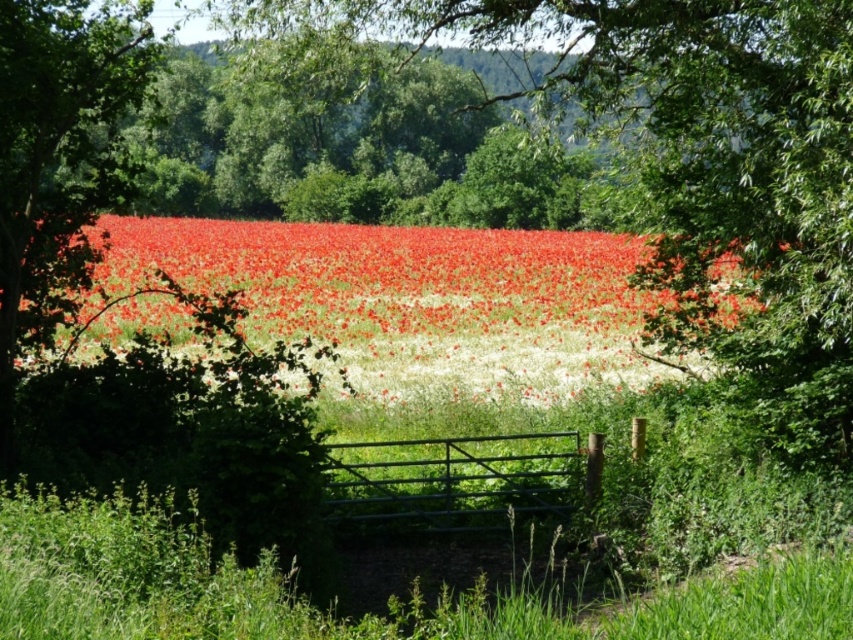
Can you confirm if bright red petals at center is bigger than metallic gate at center?

Yes.

Looking at this image, can you confirm if bright red petals at center is wider than metallic gate at center?

Yes.

Between point (473, 328) and point (352, 490), which one is positioned behind?

The point (473, 328) is more distant.

Find the location of a particular element. The image size is (853, 640). bright red petals at center is located at coordinates (413, 300).

Does green leafy tree at center have a lesser width compared to bright red petals at center?

Correct, green leafy tree at center's width is less than bright red petals at center's.

Is green leafy tree at center further to the viewer compared to bright red petals at center?

No, green leafy tree at center is closer to the viewer.

Is point (648, 113) in front of point (505, 298)?

Yes, it is.

The width and height of the screenshot is (853, 640). I want to click on green leafy tree at center, so click(693, 166).

Does green leafy tree at center have a greater height compared to metallic gate at center?

Yes.

Is green leafy tree at center closer to the viewer compared to metallic gate at center?

Yes, green leafy tree at center is closer to the viewer.

This screenshot has height=640, width=853. Identify the location of green leafy tree at center. (693, 166).

You are a GUI agent. You are given a task and a screenshot of the screen. Output one action in this format:
    pyautogui.click(x=<x>, y=<y>)
    Task: Click on the green leafy tree at center
    
    Given the screenshot: What is the action you would take?
    pyautogui.click(x=693, y=166)